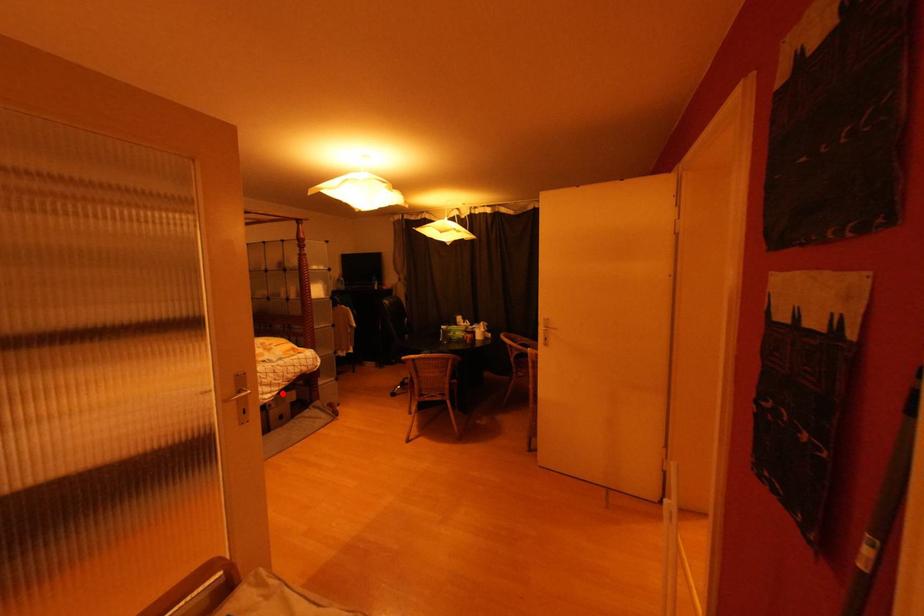
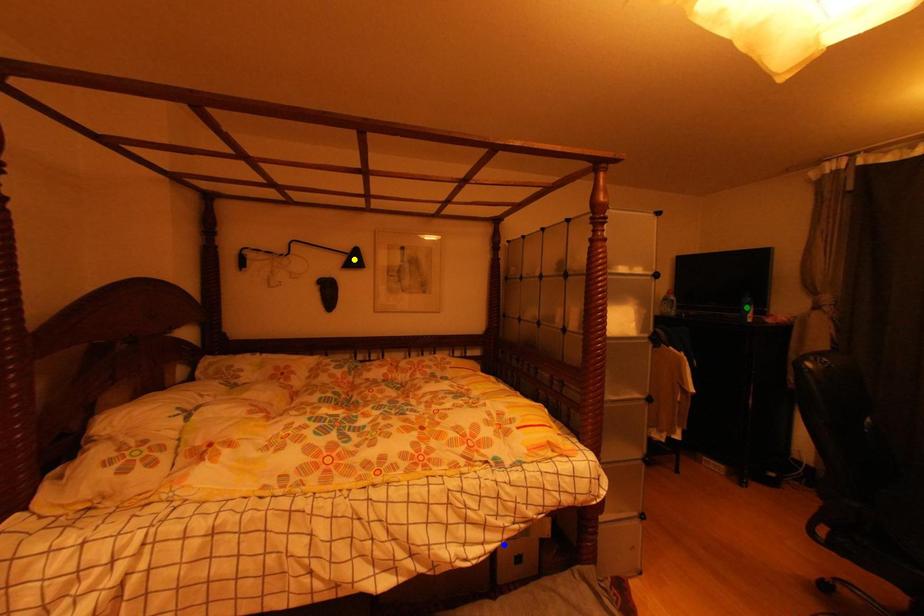
Question: I am providing you with two images of the same scene from different viewpoints. A red point is marked on the first image. You are given multiple points on the second image. Which spot in image 2 lines up with the point in image 1?

Choices:
 (A) green point
 (B) blue point
 (C) yellow point

Answer: (B)